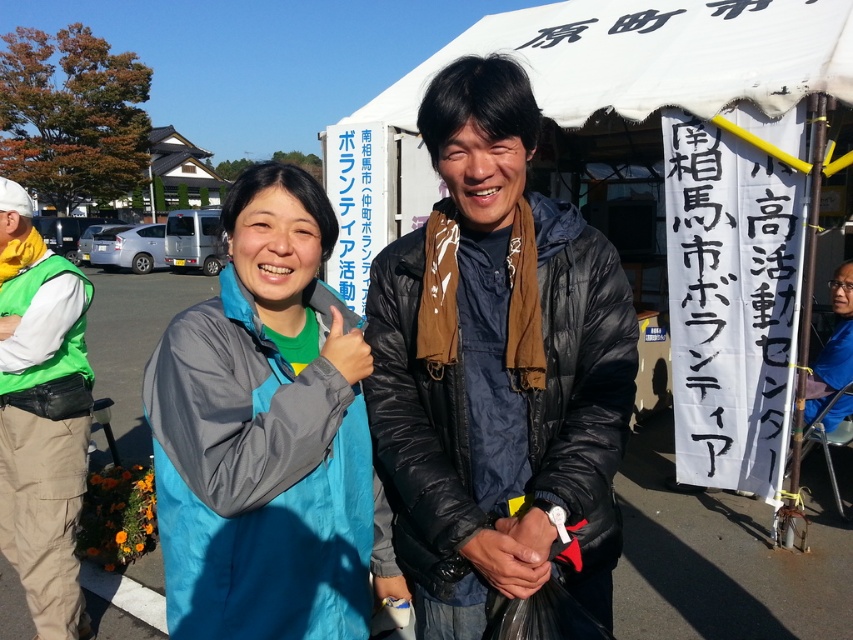
You are a photographer trying to capture a closeup of the white matte vest at left. The camera you are using has a focal length of 50mm and an aperture of f2.8. Based on the coordinates provided, can you determine if the vest is within the camera frame? The camera frame is defined as the area between coordinates 0.0 and 1.0 in both x and y axes.

The white matte vest at left is positioned at coordinates point (41,417), which falls within the camera frame boundaries of 0.0 to 1.0 in both axes. Therefore, the vest is within the camera frame and can be captured in the closeup.

You are organizing a photo shoot and need to ensure that the black puffy jacket at center and the dark blue jacket at center are both visible in the final image. Based on their positions, which jacket is covering part of the other?

The black puffy jacket at center is positioned over the dark blue jacket at center, so it is covering part of the dark blue jacket at center.